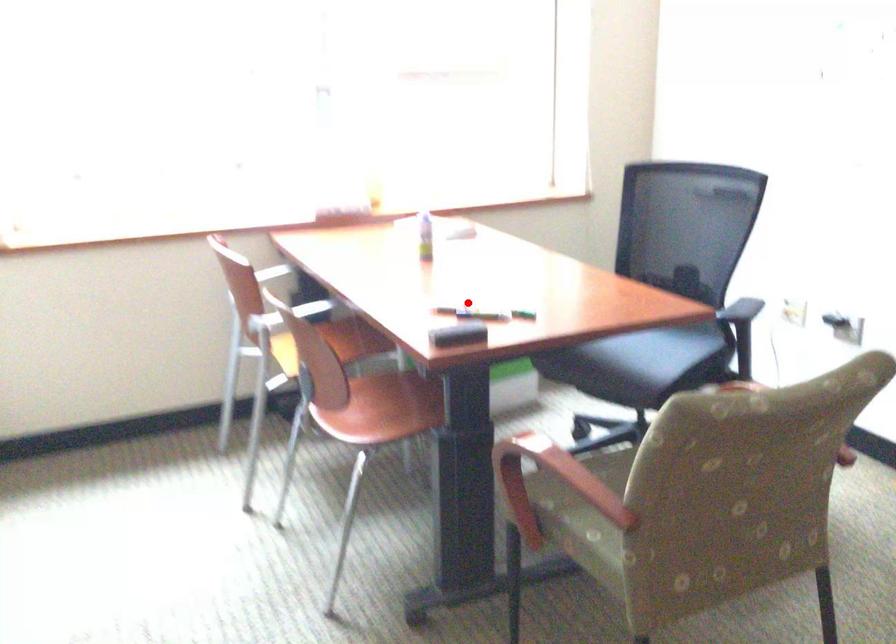
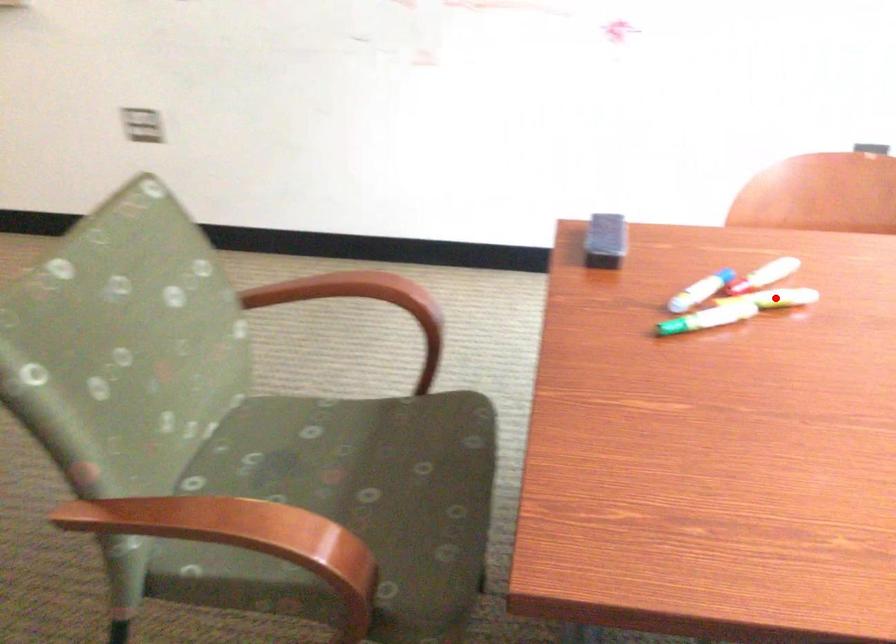
I am providing you with two images of the same scene from different viewpoints. A red point is marked on the first image and another point is marked on the second image. Do the highlighted points in image1 and image2 indicate the same real-world spot?

Yes